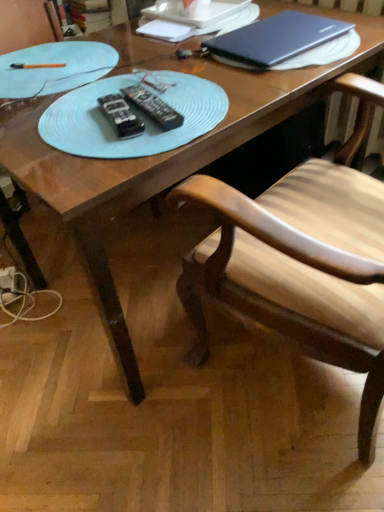
Find the location of a particular element. vacant region in front of black plastic remote at center, the first remote positioned from the left is located at coordinates (103, 157).